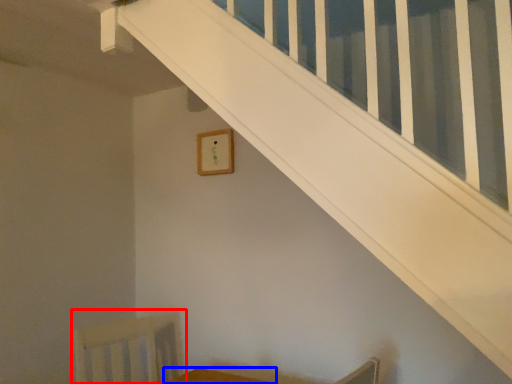
Question: Which of the following is the closest to the observer, swivel chair (highlighted by a red box) or furniture (highlighted by a blue box)?

Choices:
 (A) swivel chair
 (B) furniture

Answer: (B)